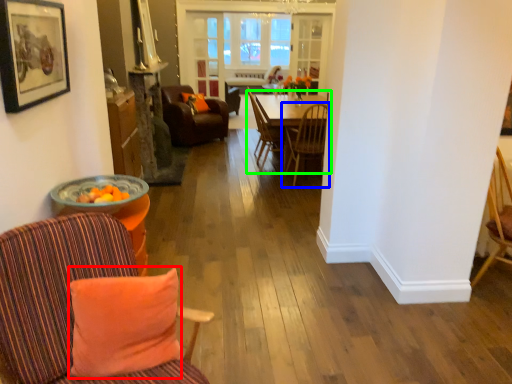
Question: Based on their relative distances, which object is nearer to pillow (highlighted by a red box)? Choose from chair (highlighted by a blue box) and kitchen & dining room table (highlighted by a green box).

Choices:
 (A) chair
 (B) kitchen & dining room table

Answer: (A)